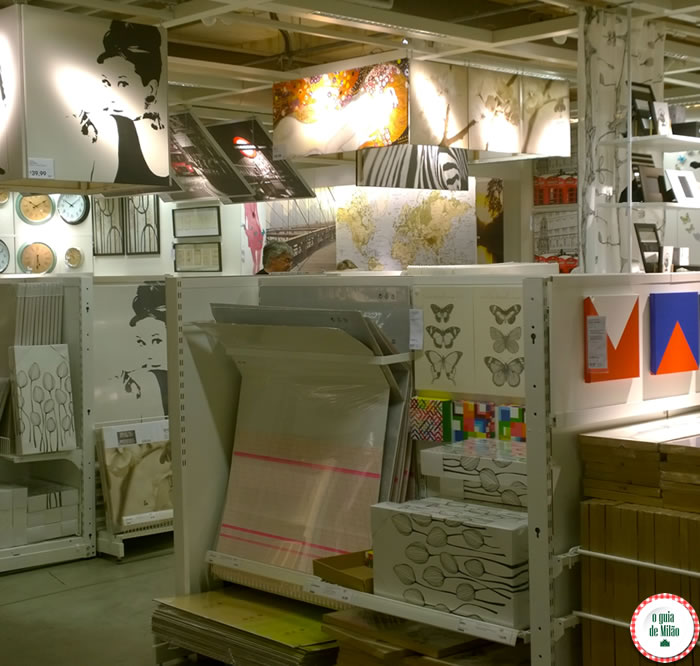
What are the coordinates of `2 prints of black and white butterflies` in the screenshot? It's located at (449, 356), (491, 345).